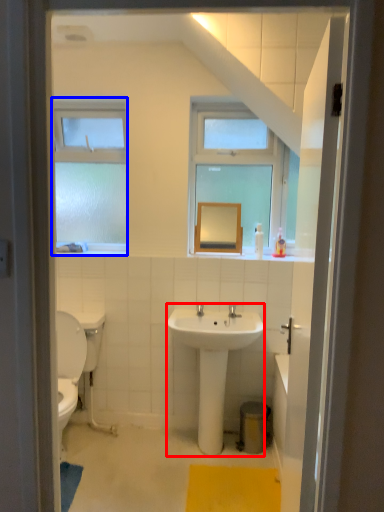
Question: Which object is closer to the camera taking this photo, sink (highlighted by a red box) or window (highlighted by a blue box)?

Choices:
 (A) sink
 (B) window

Answer: (A)